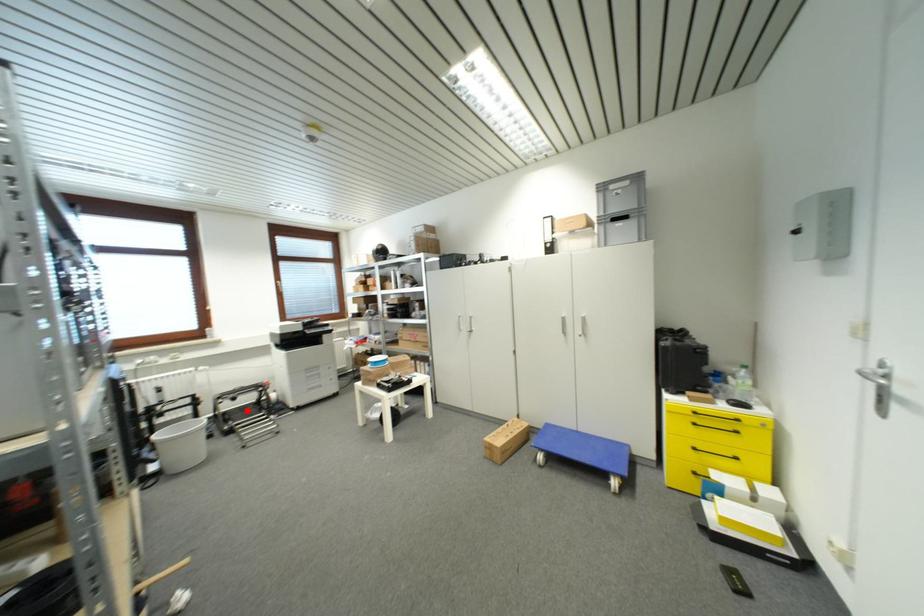
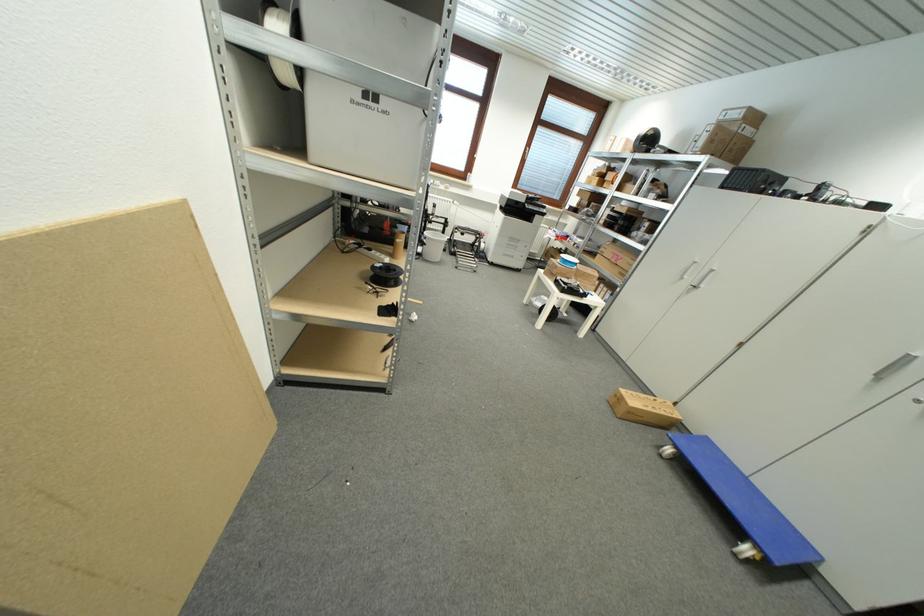
Question: I am providing you with two images of the same scene from different viewpoints. Given a red point in image1, look at the same physical point in image2. Is it:

Choices:
 (A) Closer to the viewpoint
 (B) Farther from the viewpoint

Answer: (A)